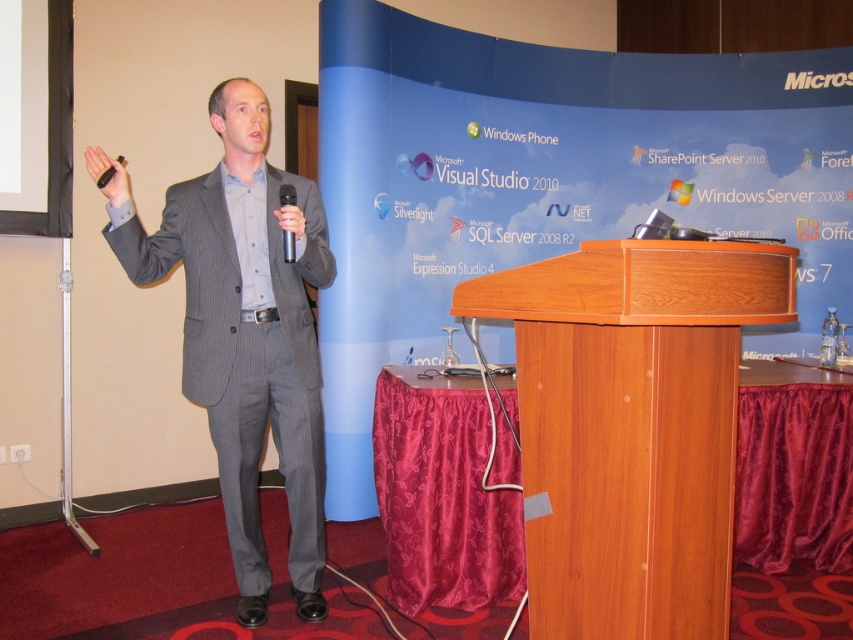
You are a photographer at the event and need to capture a clear photo of the man in his gray pinstripe suit at left and the black plastic microphone at center. Based on their positions, which object will appear closer to the camera in the photo?

The gray pinstripe suit at left is in front of the black plastic microphone at center, so the gray pinstripe suit at left will appear closer to the camera in the photo.